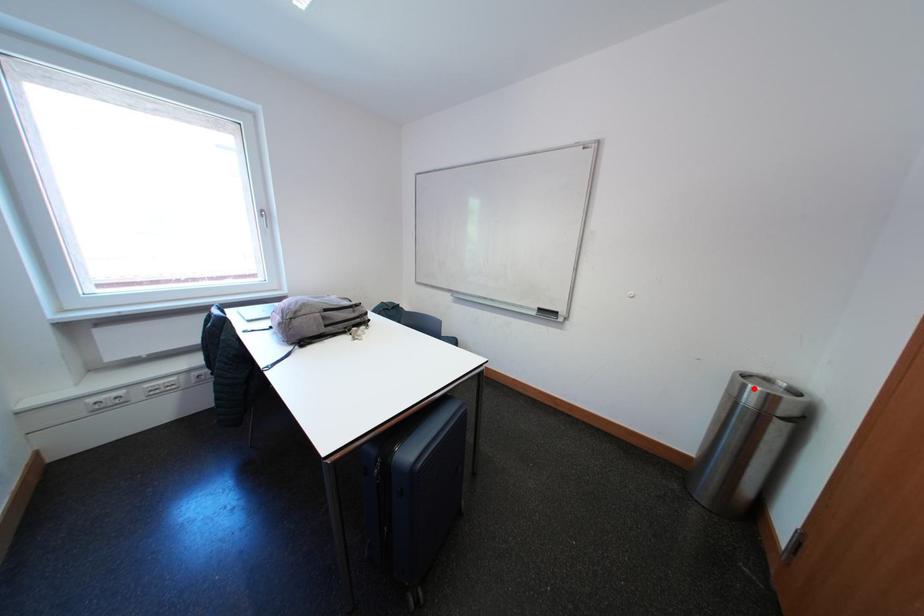
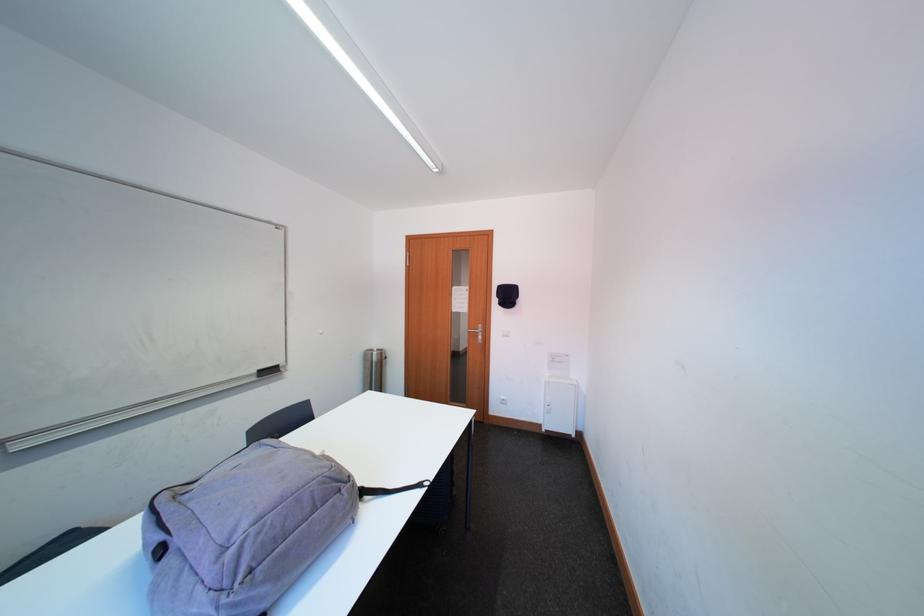
Question: A red point is marked in image1. In image2, is the corresponding 3D point closer to the camera or farther? Reply with the corresponding letter.

Choices:
 (A) The corresponding 3D point is closer.
 (B) The corresponding 3D point is farther.

Answer: (B)